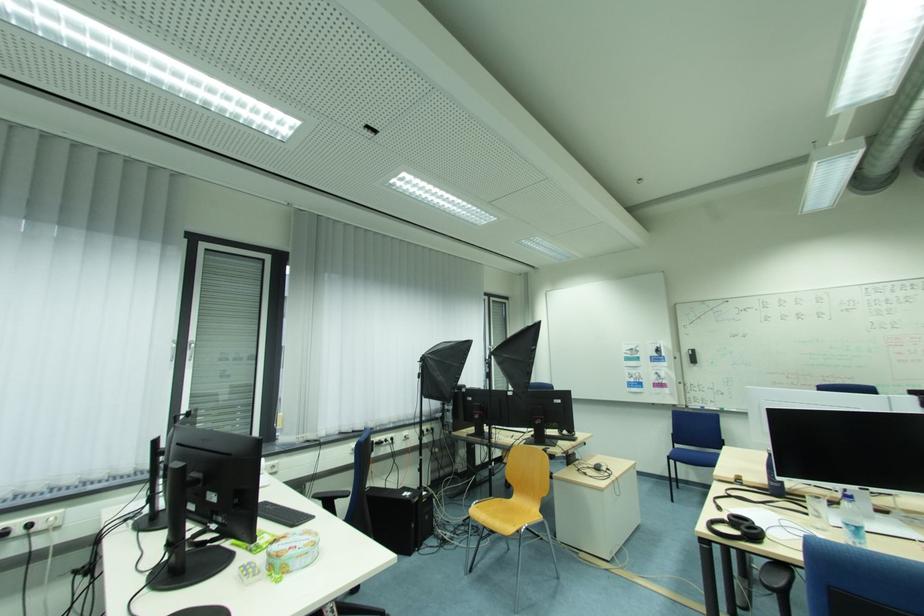
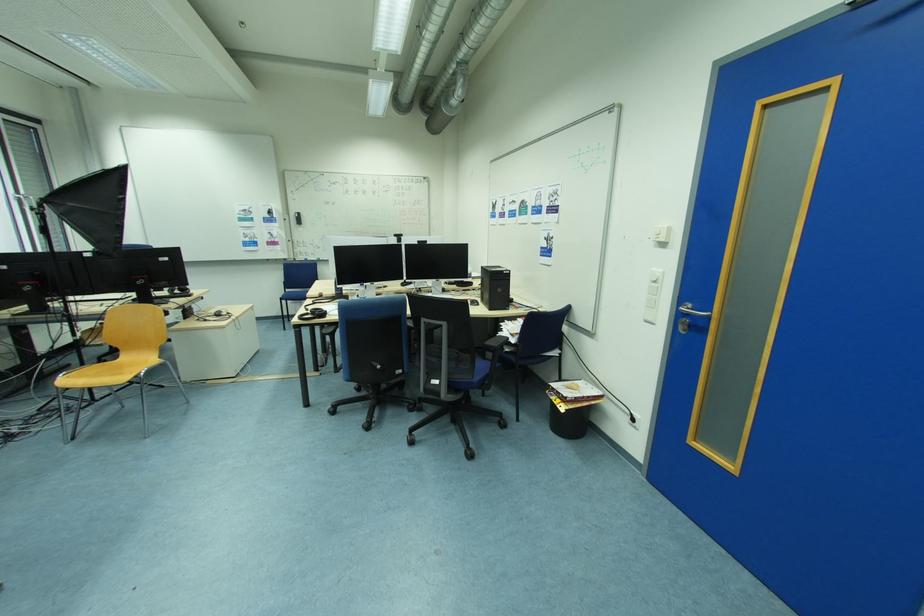
Where in the second image is the point corresponding to (x=685, y=447) from the first image?

(295, 292)